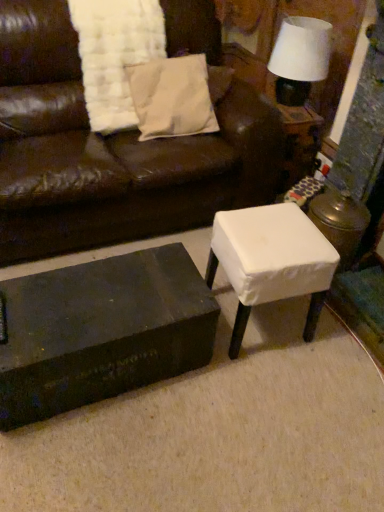
Identify the location of free spot to the right of black matte/wooden coffee table at lower left. (236, 413).